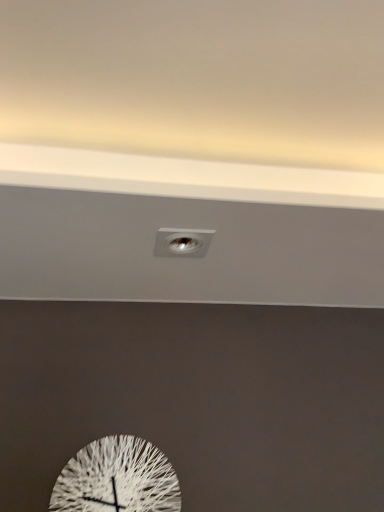
Image resolution: width=384 pixels, height=512 pixels. What are the coordinates of `metallic silver light fixture at center` in the screenshot? It's located at (182, 242).

Measure the distance between metallic silver light fixture at center and camera.

metallic silver light fixture at center is 4.12 feet from camera.

The height and width of the screenshot is (512, 384). What do you see at coordinates (182, 242) in the screenshot?
I see `metallic silver light fixture at center` at bounding box center [182, 242].

You are a GUI agent. You are given a task and a screenshot of the screen. Output one action in this format:
    pyautogui.click(x=<x>, y=<y>)
    Task: Click on the white textured clock at center
    This screenshot has width=384, height=512.
    Given the screenshot: What is the action you would take?
    pyautogui.click(x=117, y=479)

What do you see at coordinates (117, 479) in the screenshot? The width and height of the screenshot is (384, 512). I see `white textured clock at center` at bounding box center [117, 479].

The image size is (384, 512). I want to click on metallic silver light fixture at center, so click(182, 242).

In the image, is white textured clock at center on the left side or the right side of metallic silver light fixture at center?

Based on their positions, white textured clock at center is located to the left of metallic silver light fixture at center.

Which is in front, white textured clock at center or metallic silver light fixture at center?

metallic silver light fixture at center is closer to the camera.

Is point (103, 506) positioned after point (183, 252)?

Yes, it is.

From the image's perspective, is white textured clock at center below metallic silver light fixture at center?

Yes, from the image's perspective, white textured clock at center is beneath metallic silver light fixture at center.

In the scene shown: From a real-world perspective, which is physically above, white textured clock at center or metallic silver light fixture at center?

metallic silver light fixture at center.

Based on the photo, between white textured clock at center and metallic silver light fixture at center, which one has larger width?

With larger width is metallic silver light fixture at center.

Can you confirm if white textured clock at center is shorter than metallic silver light fixture at center?

In fact, white textured clock at center may be taller than metallic silver light fixture at center.

Considering the sizes of white textured clock at center and metallic silver light fixture at center in the image, is white textured clock at center bigger or smaller than metallic silver light fixture at center?

Clearly, white textured clock at center is larger in size than metallic silver light fixture at center.

Choose the correct answer: Is white textured clock at center inside metallic silver light fixture at center or outside it?

The correct answer is: outside.

Are white textured clock at center and metallic silver light fixture at center far apart?

Actually, white textured clock at center and metallic silver light fixture at center are a little close together.

Based on the photo, is metallic silver light fixture at center at the back of white textured clock at center?

white textured clock at center is not turned away from metallic silver light fixture at center.

Consider the image. Can you tell me how much white textured clock at center and metallic silver light fixture at center differ in facing direction?

The angle between the facing direction of white textured clock at center and the facing direction of metallic silver light fixture at center is 2.33 degrees.

I want to click on electric outlet above the white textured clock at center (from the image's perspective), so (x=182, y=242).

Which object is positioned more to the left, metallic silver light fixture at center or white textured clock at center?

From the viewer's perspective, white textured clock at center appears more on the left side.

Considering the positions of objects metallic silver light fixture at center and white textured clock at center in the image provided, who is in front, metallic silver light fixture at center or white textured clock at center?

metallic silver light fixture at center is more forward.

Which is nearer, (205, 254) or (83, 455)?

Point (205, 254) is positioned closer to the camera compared to point (83, 455).

From the image's perspective, does metallic silver light fixture at center appear higher than white textured clock at center?

Yes, from the image's perspective, metallic silver light fixture at center is above white textured clock at center.

From a real-world perspective, who is located higher, metallic silver light fixture at center or white textured clock at center?

From a 3D spatial view, metallic silver light fixture at center is above.

Which object is thinner, metallic silver light fixture at center or white textured clock at center?

white textured clock at center is thinner.

Who is taller, metallic silver light fixture at center or white textured clock at center?

white textured clock at center.

Can you confirm if metallic silver light fixture at center is bigger than white textured clock at center?

No.

Is metallic silver light fixture at center positioned beyond the bounds of white textured clock at center?

Yes, metallic silver light fixture at center is outside of white textured clock at center.

Is metallic silver light fixture at center next to white textured clock at center?

No.

Does metallic silver light fixture at center turn towards white textured clock at center?

No, metallic silver light fixture at center is not facing towards white textured clock at center.

How different are the orientations of metallic silver light fixture at center and white textured clock at center in degrees?

The facing directions of metallic silver light fixture at center and white textured clock at center are 2.33 degrees apart.

Identify the location of electric outlet located on the right of white textured clock at center. The image size is (384, 512). (182, 242).

Where is `wall clock that appears below the metallic silver light fixture at center (from a real-world perspective)`? wall clock that appears below the metallic silver light fixture at center (from a real-world perspective) is located at coordinates (117, 479).

The width and height of the screenshot is (384, 512). I want to click on electric outlet in front of the white textured clock at center, so click(182, 242).